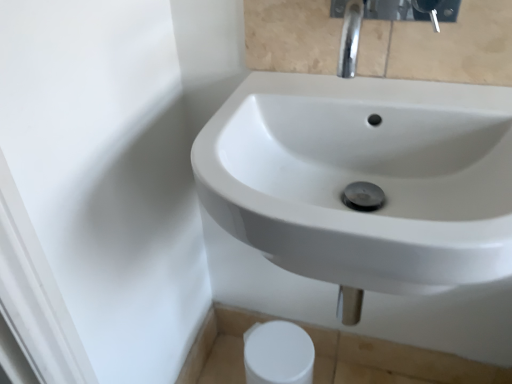
The height and width of the screenshot is (384, 512). What do you see at coordinates (442, 47) in the screenshot? I see `chrome metallic faucet at upper center` at bounding box center [442, 47].

Measure the distance between white glossy sink at center and camera.

white glossy sink at center and camera are 16.51 inches apart.

The image size is (512, 384). What do you see at coordinates (278, 354) in the screenshot? I see `white matte toilet paper at lower center` at bounding box center [278, 354].

Image resolution: width=512 pixels, height=384 pixels. I want to click on chrome metallic faucet at upper center, so click(442, 47).

Does chrome metallic faucet at upper center have a lesser width compared to white matte toilet paper at lower center?

No.

Is chrome metallic faucet at upper center next to white matte toilet paper at lower center?

chrome metallic faucet at upper center is not next to white matte toilet paper at lower center, and they're not touching.

Considering the points (256, 9) and (296, 331), which point is in front, point (256, 9) or point (296, 331)?

The point (256, 9) is in front.

Is chrome metallic faucet at upper center thinner than white glossy sink at center?

Yes.

From the picture: Is chrome metallic faucet at upper center next to white glossy sink at center and touching it?

chrome metallic faucet at upper center is not next to white glossy sink at center, and they're not touching.

Considering the relative sizes of chrome metallic faucet at upper center and white glossy sink at center in the image provided, is chrome metallic faucet at upper center smaller than white glossy sink at center?

Correct, chrome metallic faucet at upper center occupies less space than white glossy sink at center.

Does point (413, 155) appear closer or farther from the camera than point (261, 8)?

Point (413, 155) is closer to the camera than point (261, 8).

From a real-world perspective, which is physically below, white glossy sink at center or chrome metallic faucet at upper center?

white glossy sink at center.

Does white glossy sink at center touch chrome metallic faucet at upper center?

No, white glossy sink at center is not making contact with chrome metallic faucet at upper center.

Can you confirm if white glossy sink at center is shorter than chrome metallic faucet at upper center?

No.

From a real-world perspective, which object stands above the other?

white glossy sink at center is physically above.

Considering the relative sizes of white glossy sink at center and white matte toilet paper at lower center in the image provided, is white glossy sink at center shorter than white matte toilet paper at lower center?

No.

Is white glossy sink at center turned away from white matte toilet paper at lower center?

white glossy sink at center is not turned away from white matte toilet paper at lower center.

Would you say white matte toilet paper at lower center is inside or outside chrome metallic faucet at upper center?

white matte toilet paper at lower center is outside chrome metallic faucet at upper center.

Identify the location of toilet paper located on the left of chrome metallic faucet at upper center. (278, 354).

Is white matte toilet paper at lower center next to chrome metallic faucet at upper center?

No, white matte toilet paper at lower center is not next to chrome metallic faucet at upper center.

Considering the sizes of white matte toilet paper at lower center and chrome metallic faucet at upper center in the image, is white matte toilet paper at lower center taller or shorter than chrome metallic faucet at upper center?

Considering their sizes, white matte toilet paper at lower center has more height than chrome metallic faucet at upper center.

The image size is (512, 384). I want to click on toilet paper below the white glossy sink at center (from the image's perspective), so click(278, 354).

Is white matte toilet paper at lower center far from white glossy sink at center?

No.

Considering the points (273, 325) and (213, 191), which point is behind, point (273, 325) or point (213, 191)?

The point (273, 325) is farther.

Considering the sizes of objects white matte toilet paper at lower center and white glossy sink at center in the image provided, who is taller, white matte toilet paper at lower center or white glossy sink at center?

white glossy sink at center.

At what (x,y) coordinates should I click in order to perform the action: click on mirror positioned vertically above the white matte toilet paper at lower center (from a real-world perspective). Please return your answer as a coordinate pair (x, y). The image size is (512, 384). Looking at the image, I should click on (442, 47).

I want to click on mirror behind the white glossy sink at center, so click(x=442, y=47).

Considering their positions, is chrome metallic faucet at upper center positioned closer to white glossy sink at center than white matte toilet paper at lower center?

chrome metallic faucet at upper center is positioned closer to the anchor white glossy sink at center.

Which object lies nearer to the anchor point white glossy sink at center, white matte toilet paper at lower center or chrome metallic faucet at upper center?

Among the two, chrome metallic faucet at upper center is located nearer to white glossy sink at center.

Estimate the real-world distances between objects in this image. Which object is further from white matte toilet paper at lower center, chrome metallic faucet at upper center or white glossy sink at center?

Based on the image, chrome metallic faucet at upper center appears to be further to white matte toilet paper at lower center.

Consider the image. When comparing their distances from white matte toilet paper at lower center, does white glossy sink at center or chrome metallic faucet at upper center seem closer?

white glossy sink at center.

Which object lies nearer to the anchor point chrome metallic faucet at upper center, white glossy sink at center or white matte toilet paper at lower center?

Among the two, white glossy sink at center is located nearer to chrome metallic faucet at upper center.

When comparing their distances from chrome metallic faucet at upper center, does white matte toilet paper at lower center or white glossy sink at center seem further?

white matte toilet paper at lower center is further to chrome metallic faucet at upper center.

Locate an element on the screen. The image size is (512, 384). sink between chrome metallic faucet at upper center and white matte toilet paper at lower center from top to bottom is located at coordinates (364, 180).